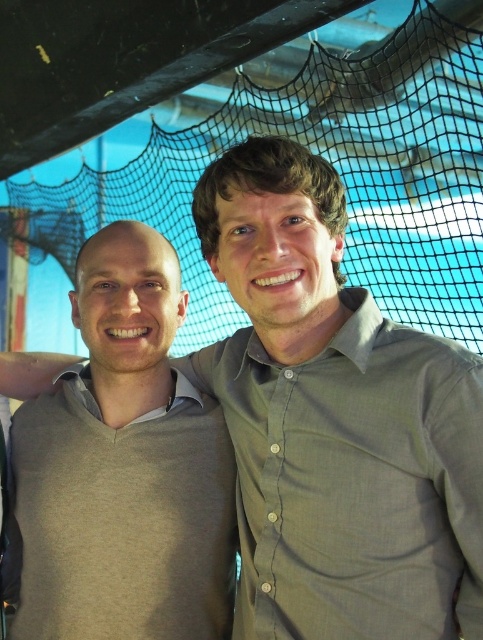
Question: Is light gray sweater at center above black mesh net at upper center?

Choices:
 (A) no
 (B) yes

Answer: (A)

Question: Which point is closer to the camera taking this photo?

Choices:
 (A) (39, 634)
 (B) (353, 241)

Answer: (A)

Question: Can you confirm if light gray sweater at center is positioned to the right of black mesh net at upper center?

Choices:
 (A) yes
 (B) no

Answer: (B)

Question: Does light gray sweater at center appear over black mesh net at upper center?

Choices:
 (A) no
 (B) yes

Answer: (A)